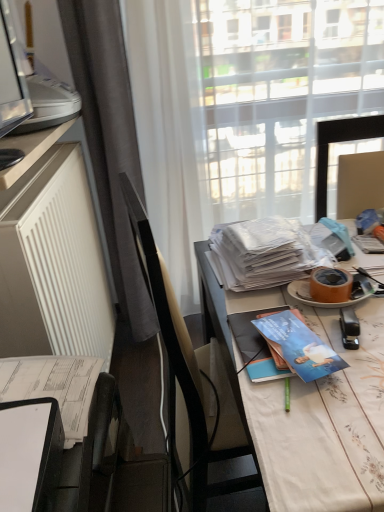
This screenshot has height=512, width=384. I want to click on matte brown adhesive tape at right, so click(x=330, y=285).

You are a GUI agent. You are given a task and a screenshot of the screen. Output one action in this format:
    pyautogui.click(x=<x>, y=<y>)
    Task: Click on the white glossy desk at center, which ranks as the 1th desk in right-to-left order
    This screenshot has height=512, width=384.
    Given the screenshot: What is the action you would take?
    pyautogui.click(x=308, y=405)

Measure the distance between point (x=43, y=81) and camera.

Point (x=43, y=81) and camera are 1.36 meters apart.

The height and width of the screenshot is (512, 384). I want to click on matte black monitor at left, the 1th desk from the top, so click(x=29, y=150).

Which of these two, white glossy desk at center, which is the first desk in bottom-to-top order, or white matte radiator at left, is wider?

Wider between the two is white glossy desk at center, which is the first desk in bottom-to-top order.

Is white glossy desk at center, which ranks as the 1th desk in right-to-left order, to the right of white matte radiator at left from the viewer's perspective?

Yes, white glossy desk at center, which ranks as the 1th desk in right-to-left order, is to the right of white matte radiator at left.

Is white glossy desk at center, which ranks as the 1th desk in right-to-left order, aimed at white matte radiator at left?

No, white glossy desk at center, which ranks as the 1th desk in right-to-left order, is not aimed at white matte radiator at left.

Is point (323, 452) farther from camera compared to point (90, 291)?

No.

From the image's perspective, would you say white matte radiator at left is shown under white glossy magazine at center, which is the second magazine in bottom-to-top order?

Yes, from the image's perspective, white matte radiator at left is beneath white glossy magazine at center, which is the second magazine in bottom-to-top order.

Is white matte radiator at left at the right side of white glossy magazine at center, the 1th magazine when ordered from back to front?

In fact, white matte radiator at left is to the left of white glossy magazine at center, the 1th magazine when ordered from back to front.

Is white matte radiator at left located outside white glossy magazine at center, acting as the 1th magazine starting from the top?

Yes, white matte radiator at left is outside of white glossy magazine at center, acting as the 1th magazine starting from the top.

Which is behind, point (35, 252) or point (27, 373)?

The point (35, 252) is farther.

How many degrees apart are the facing directions of white matte radiator at left and white paper journal at lower left?

The angular difference between white matte radiator at left and white paper journal at lower left is 0.125 degrees.

Could you tell me if white matte radiator at left is facing white paper journal at lower left?

No, white matte radiator at left is not aimed at white paper journal at lower left.

Which of these two, white matte radiator at left or white paper journal at lower left, is smaller?

white paper journal at lower left.

Can you confirm if blue glossy book at center, the 1th magazine when ordered from bottom to top, is wider than white matte radiator at left?

Correct, the width of blue glossy book at center, the 1th magazine when ordered from bottom to top, exceeds that of white matte radiator at left.

Is blue glossy book at center, the second magazine positioned from the top, in front of white matte radiator at left?

Yes, blue glossy book at center, the second magazine positioned from the top, is in front of white matte radiator at left.

Can you confirm if matte black monitor at left, the 1th desk from the top, is wider than matte brown adhesive tape at right?

Yes, matte black monitor at left, the 1th desk from the top, is wider than matte brown adhesive tape at right.

Is matte black monitor at left, which is counted as the 2th desk, starting from the bottom, shorter than matte brown adhesive tape at right?

Indeed, matte black monitor at left, which is counted as the 2th desk, starting from the bottom, has a lesser height compared to matte brown adhesive tape at right.

There is a matte brown adhesive tape at right. Where is `desk above it (from a real-world perspective)`? desk above it (from a real-world perspective) is located at coordinates (29, 150).

From the image's perspective, would you say white glossy magazine at center, acting as the 1th magazine starting from the top, is positioned over orange matte plate at right?

Indeed, from the image's perspective, white glossy magazine at center, acting as the 1th magazine starting from the top, is shown above orange matte plate at right.

Measure the distance between white glossy magazine at center, acting as the 1th magazine starting from the top, and orange matte plate at right.

white glossy magazine at center, acting as the 1th magazine starting from the top, is 5.83 inches away from orange matte plate at right.

From a real-world perspective, is white glossy magazine at center, the 1th magazine when ordered from back to front, beneath orange matte plate at right?

Actually, white glossy magazine at center, the 1th magazine when ordered from back to front, is physically above orange matte plate at right in the real world.

How many degrees apart are the facing directions of white glossy magazine at center, which is the second magazine in bottom-to-top order, and orange matte plate at right?

The facing directions of white glossy magazine at center, which is the second magazine in bottom-to-top order, and orange matte plate at right are 2.1 degrees apart.

Is orange matte plate at right directly adjacent to matte black monitor at left, positioned as the second desk in right-to-left order?

There is a gap between orange matte plate at right and matte black monitor at left, positioned as the second desk in right-to-left order.

Is orange matte plate at right located outside matte black monitor at left, which is counted as the 2th desk, starting from the bottom?

Indeed, orange matte plate at right is completely outside matte black monitor at left, which is counted as the 2th desk, starting from the bottom.

From the image's perspective, relative to matte black monitor at left, the 1th desk from the top, is orange matte plate at right above or below?

From the image's perspective, orange matte plate at right appears below matte black monitor at left, the 1th desk from the top.

Is point (356, 287) farther from viewer compared to point (35, 151)?

No, (356, 287) is in front of (35, 151).

The height and width of the screenshot is (512, 384). What are the coordinates of `radiator behind the white glossy desk at center, which is the first desk in bottom-to-top order` in the screenshot? It's located at (53, 263).

The height and width of the screenshot is (512, 384). I want to click on magazine above the white matte radiator at left (from the image's perspective), so click(x=264, y=253).

Estimate the real-world distances between objects in this image. Which object is further from blue glossy book at center, the second magazine in the back-to-front sequence, white paper journal at lower left or blue glossy book at center?

Based on the image, white paper journal at lower left appears to be further to blue glossy book at center, the second magazine in the back-to-front sequence.

Looking at the image, which one is located further to white matte radiator at left, white paper journal at lower left or matte black monitor at left, the 1th desk from the top?

white paper journal at lower left is further to white matte radiator at left.

When comparing their distances from white plastic printer at upper left, does white glossy magazine at center, which is the second magazine in bottom-to-top order, or white matte radiator at left seem further?

→ Based on the image, white glossy magazine at center, which is the second magazine in bottom-to-top order, appears to be further to white plastic printer at upper left.

Based on their spatial positions, is white paper journal at lower left or white plastic printer at upper left further from translucent fabric at center?

white paper journal at lower left.

Based on their spatial positions, is matte black monitor at left, which is counted as the 2th desk, starting from the bottom, or matte brown adhesive tape at right closer to white paper journal at lower left?

Among the two, matte black monitor at left, which is counted as the 2th desk, starting from the bottom, is located nearer to white paper journal at lower left.

Based on the photo, estimate the real-world distances between objects in this image. Which object is further from blue glossy book at center, which ranks as the first magazine in front-to-back order, matte black monitor at left, the 1th desk from the top, or white paper journal at lower left?

Based on the image, matte black monitor at left, the 1th desk from the top, appears to be further to blue glossy book at center, which ranks as the first magazine in front-to-back order.

Looking at the image, which one is located further to blue glossy book at center, matte brown adhesive tape at right or blue glossy book at center, the second magazine in the back-to-front sequence?

Based on the image, matte brown adhesive tape at right appears to be further to blue glossy book at center.

Estimate the real-world distances between objects in this image. Which object is further from matte brown adhesive tape at right, orange matte plate at right or white matte radiator at left?

Among the two, white matte radiator at left is located further to matte brown adhesive tape at right.

Image resolution: width=384 pixels, height=512 pixels. What are the coordinates of `adhesive tape between white glossy magazine at center, which is the second magazine in bottom-to-top order, and orange matte plate at right from left to right` in the screenshot? It's located at (330, 285).

I want to click on book located between white matte radiator at left and matte brown adhesive tape at right in the left-right direction, so click(x=299, y=346).

The width and height of the screenshot is (384, 512). Identify the location of adhesive tape situated between matte black monitor at left, positioned as the second desk in right-to-left order, and translucent fabric at center from left to right. (330, 285).

Identify the location of magazine positioned between white glossy desk at center, arranged as the second desk when viewed from the left, and orange matte plate at right from near to far. Image resolution: width=384 pixels, height=512 pixels. (256, 346).